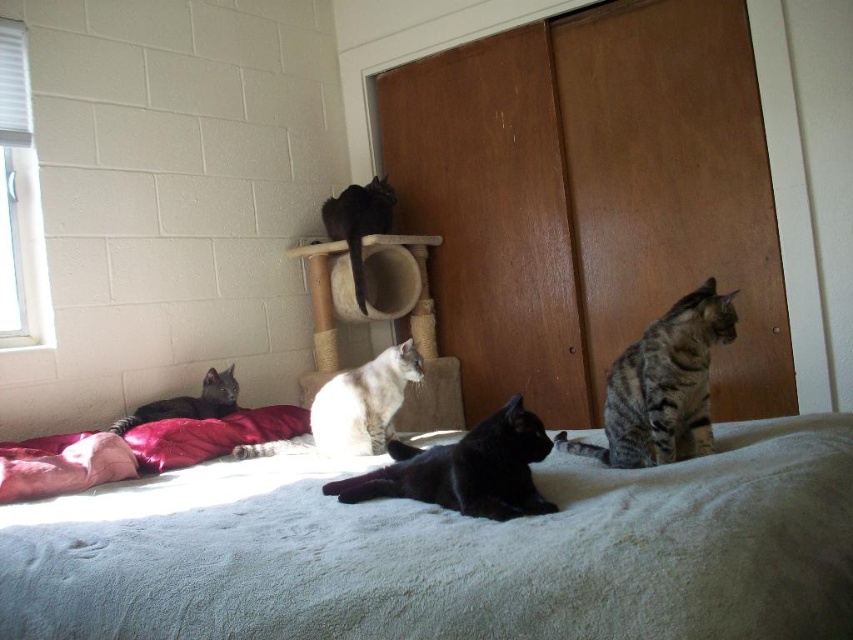
You are a photographer trying to capture a photo of the shiny black cat at center and the white fur cat at center. Based on their positions, which cat should you focus on first if you want to include both in the frame without moving the camera?

The white fur cat at center is on the left side of the shiny black cat at center, so you should focus on the white fur cat at center first to ensure both are in the frame without moving the camera.

You are a cat owner who wants to place a new toy between the white soft bed at center and the shiny black cat at center. The toy requires 8 inches of space to be placed safely. Is there enough space between them?

The white soft bed at center is 7.87 inches from the shiny black cat at center. Since the required space is 8 inches, there is not enough space to place the toy safely between them.